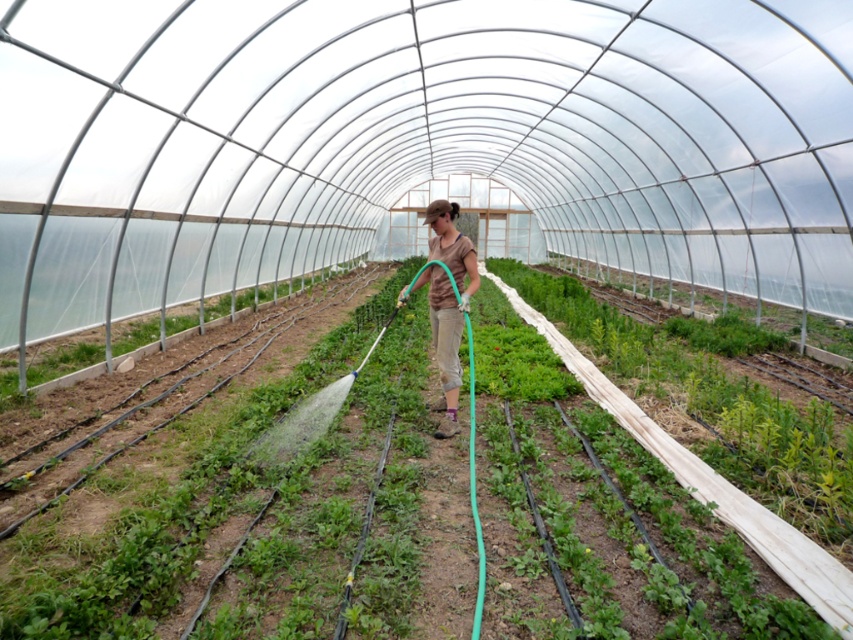
Where is the green leafy plant at center located in the greenhouse?

The green leafy plant at center is located at point (265, 518).

You are standing in the greenhouse and need to water the green leafy plant at center. Where should you aim the hose to reach it?

The green leafy plant at center is located at point (265, 518), so aim the hose towards that coordinate to reach it.

You are a visitor in the greenhouse and see the brown cotton shirt at center and the green leafy plant at left. Which object is positioned higher in the image?

The brown cotton shirt at center is located above the green leafy plant at left, so it is positioned higher in the image.